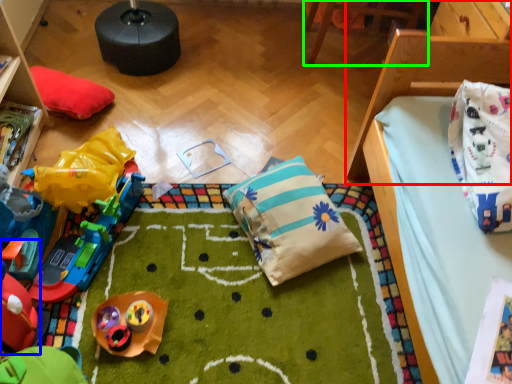
Question: Based on their relative distances, which object is farther from furniture (highlighted by a red box)? Choose from toy (highlighted by a blue box) and furniture (highlighted by a green box).

Choices:
 (A) toy
 (B) furniture

Answer: (A)